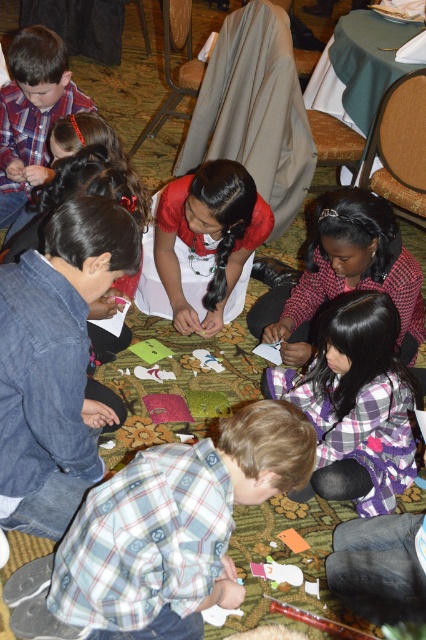
You are a photographer positioned in front of the children. You need to take a photo that clearly shows both the matte red blouse at center and the matte plaid shirt at upper left. Which child should you focus on first to ensure both are in focus?

You should focus on the matte red blouse at center first because it is closer to the viewer than the matte plaid shirt at upper left. By focusing on the closer object, the depth of field may include both in focus.

You are a child participating in the craft activity and need to reach both the point at point (146,276) and the point at point (26,163). Which point should you reach for first to minimize the distance you walk?

→ You should reach for point (146,276) first because it is closer to you than point (26,163).

You are a photographer standing at the entrance of the room. You want to take a photo of the matte red blouse at center. Where should you position your camera to capture the blouse in the frame?

To capture the matte red blouse at center in the frame, position your camera at the entrance facing towards the center of the room where the blouse is located at coordinates approximately 0.383 on the x and 0.479 on the y axis.